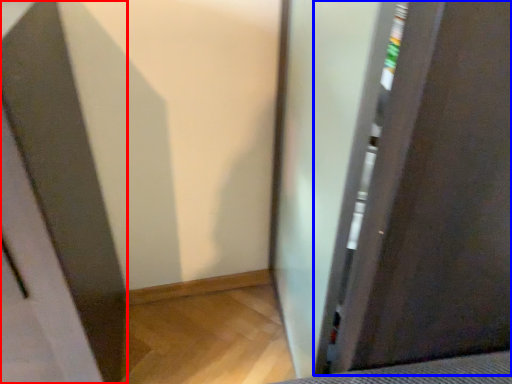
Question: Which object appears closest to the camera in this image, screen door (highlighted by a red box) or screen door (highlighted by a blue box)?

Choices:
 (A) screen door
 (B) screen door

Answer: (A)